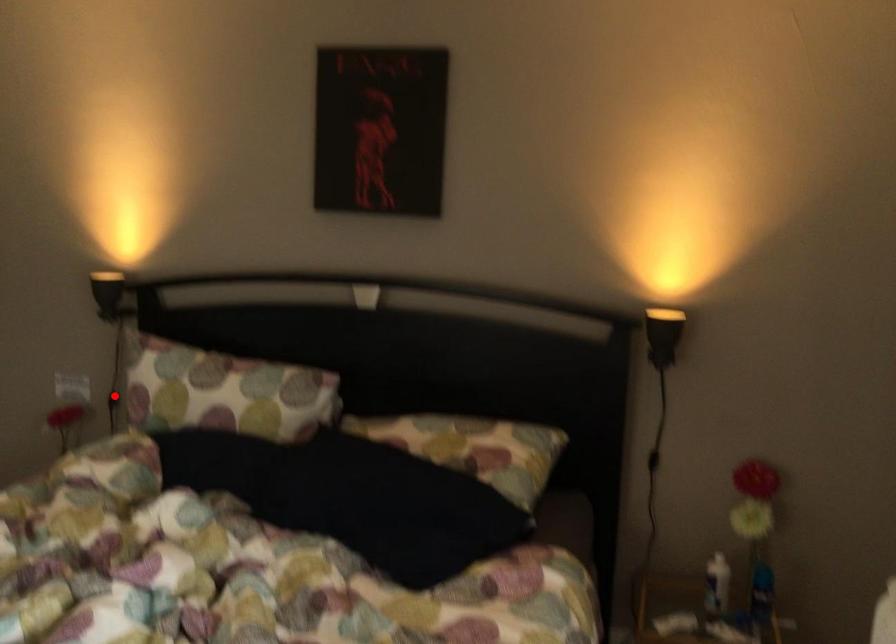
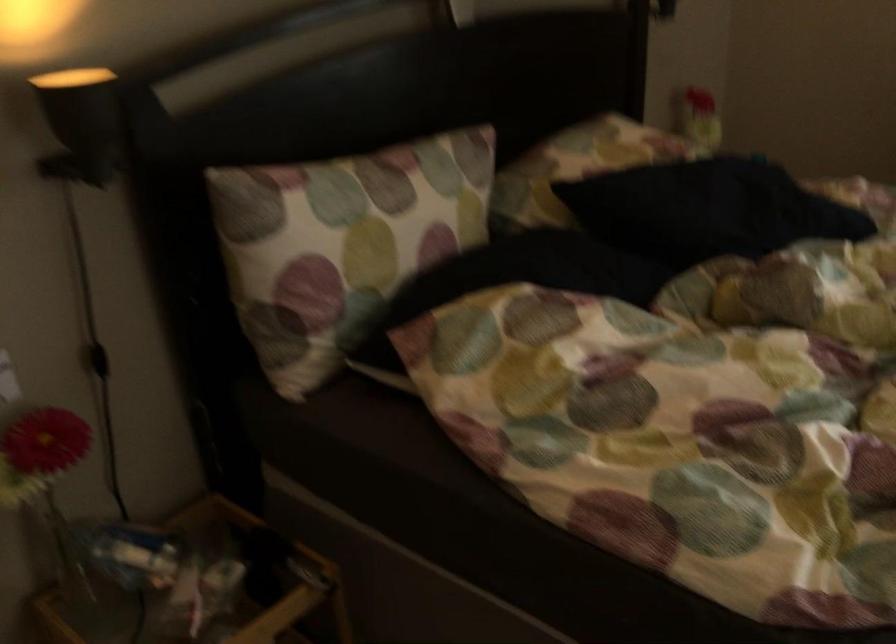
Find the pixel in the second image that matches the highlighted location in the first image.

(98, 360)